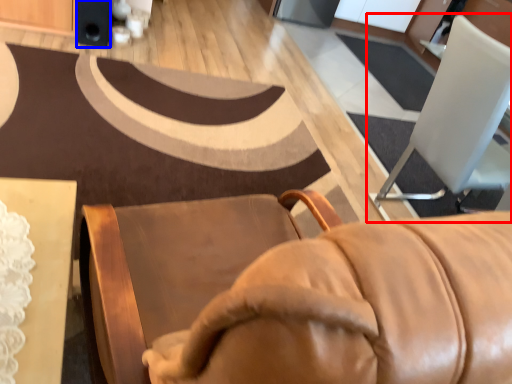
Question: Among these objects, which one is farthest to the camera, chair (highlighted by a red box) or speaker (highlighted by a blue box)?

Choices:
 (A) chair
 (B) speaker

Answer: (B)